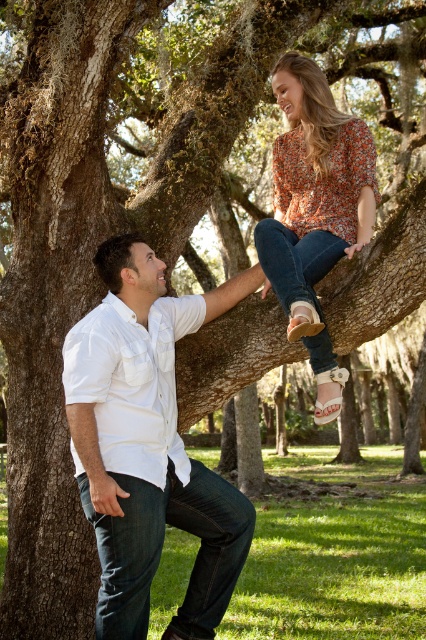
You are a photographer standing at the center of the park. You want to take a photo of the white cotton shirt at left. Where should you point your camera to capture it?

You should point your camera towards the left side of the frame at coordinates approximately 0.697 on the x and 0.347 on the y axis to capture the white cotton shirt at left.